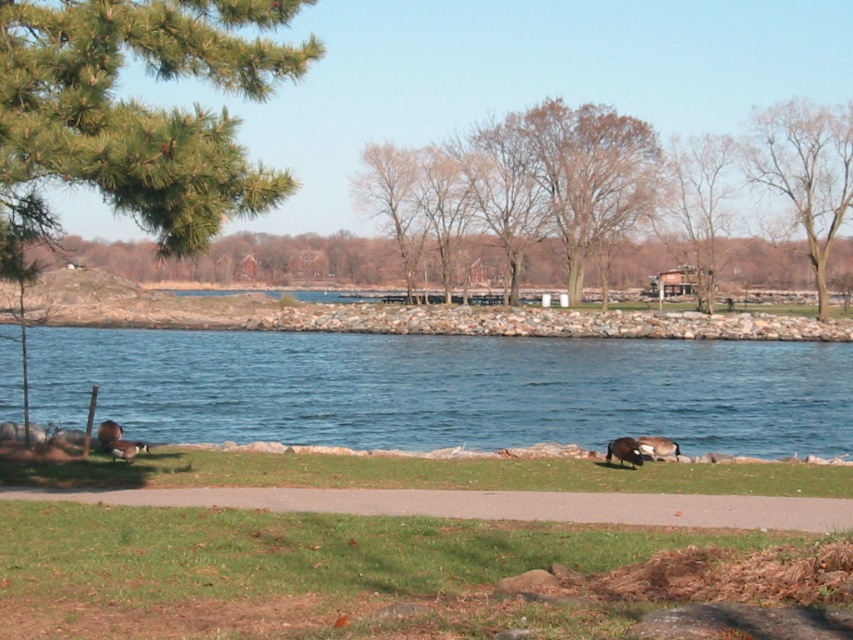
Looking at this image, you are standing at the edge of the lake and want to walk to the point marked as point (170, 132) and then to point (648, 449). Which point will you reach first?

You will reach point (170, 132) first because it is closer to you than point (648, 449).